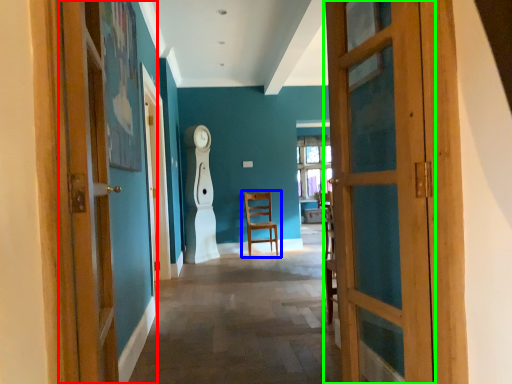
Question: Which object is positioned closest to door (highlighted by a red box)? Select from chair (highlighted by a blue box) and door (highlighted by a green box).

Choices:
 (A) chair
 (B) door

Answer: (B)